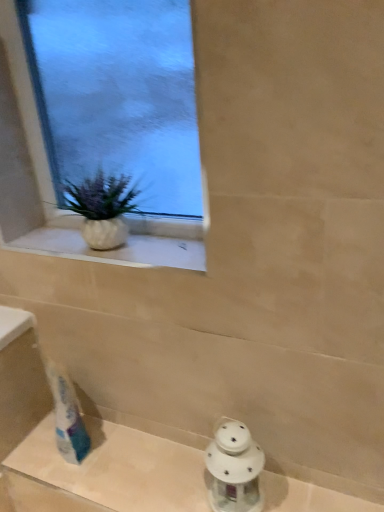
I want to click on white porcelain lantern at lower right, so click(234, 468).

From the image's perspective, is white porcelain lantern at lower right on top of clear glass window at upper left?

Incorrect, from the image's perspective, white porcelain lantern at lower right is lower than clear glass window at upper left.

Between white porcelain lantern at lower right and clear glass window at upper left, which one appears on the left side from the viewer's perspective?

Positioned to the left is clear glass window at upper left.

Is white porcelain lantern at lower right facing away from clear glass window at upper left?

No, white porcelain lantern at lower right is not facing the opposite direction of clear glass window at upper left.

In the scene shown: From a real-world perspective, is white porcelain lantern at lower right beneath clear glass window at upper left?

Yes, from a real-world perspective, white porcelain lantern at lower right is beneath clear glass window at upper left.

Looking at this image, which of these two, white glass lantern at lower center or clear glass window at upper left, is thinner?

With smaller width is clear glass window at upper left.

Is white glass lantern at lower center closer to camera compared to clear glass window at upper left?

Yes, it is.

From the image's perspective, relative to clear glass window at upper left, is white glass lantern at lower center above or below?

From the image's perspective, white glass lantern at lower center appears below clear glass window at upper left.

Considering the relative positions of white glass lantern at lower center and white porcelain lantern at lower right in the image provided, is white glass lantern at lower center to the left of white porcelain lantern at lower right from the viewer's perspective?

Correct, you'll find white glass lantern at lower center to the left of white porcelain lantern at lower right.

This screenshot has height=512, width=384. I want to click on porcelain that is behind the white glass lantern at lower center, so click(234, 468).

From the image's perspective, is white glass lantern at lower center located above white porcelain lantern at lower right?

No, from the image's perspective, white glass lantern at lower center is not above white porcelain lantern at lower right.

Can we say white glass lantern at lower center lies outside white porcelain lantern at lower right?

Yes, white glass lantern at lower center is not within white porcelain lantern at lower right.

Is white textured vase at upper left to the left of clear glass window at upper left from the viewer's perspective?

Indeed, white textured vase at upper left is positioned on the left side of clear glass window at upper left.

Considering the relative sizes of white textured vase at upper left and clear glass window at upper left in the image provided, is white textured vase at upper left thinner than clear glass window at upper left?

Incorrect, the width of white textured vase at upper left is not less than that of clear glass window at upper left.

From the image's perspective, is white textured vase at upper left positioned above or below clear glass window at upper left?

white textured vase at upper left is below clear glass window at upper left.

Where is `window above the white textured vase at upper left (from the image's perspective)`? The image size is (384, 512). window above the white textured vase at upper left (from the image's perspective) is located at coordinates (101, 125).

Is clear glass window at upper left with white porcelain lantern at lower right?

There is a gap between clear glass window at upper left and white porcelain lantern at lower right.

From the image's perspective, is clear glass window at upper left located above or below white porcelain lantern at lower right?

Based on their image positions, clear glass window at upper left is located above white porcelain lantern at lower right.

Which point is more forward, (104, 61) or (236, 441)?

The point (236, 441) is closer to the camera.

From the image's perspective, between white textured vase at upper left and white glass lantern at lower center, who is located below?

white glass lantern at lower center appears lower in the image.

Is white textured vase at upper left in front of white glass lantern at lower center?

No, white textured vase at upper left is further to the viewer.

Is white textured vase at upper left facing away from white glass lantern at lower center?

No, white textured vase at upper left is not facing away from white glass lantern at lower center.

This screenshot has height=512, width=384. I want to click on bath that is under the white textured vase at upper left (from a real-world perspective), so click(x=118, y=468).

Looking at this image, from a real-world perspective, is white glass lantern at lower center positioned above or below white textured vase at upper left?

Clearly, from a real-world perspective, white glass lantern at lower center is below white textured vase at upper left.

Looking at this image, based on their positions, is white glass lantern at lower center located to the left or right of white textured vase at upper left?

white glass lantern at lower center is positioned on white textured vase at upper left's right side.

Locate an element on the screen. porcelain on the right of the clear glass window at upper left is located at coordinates (234, 468).

Where is `bath below the clear glass window at upper left (from the image's perspective)`? bath below the clear glass window at upper left (from the image's perspective) is located at coordinates (118, 468).

Which object lies further to the anchor point white porcelain lantern at lower right, clear glass window at upper left or white textured vase at upper left?

The object further to white porcelain lantern at lower right is clear glass window at upper left.

Based on their spatial positions, is white glass lantern at lower center or white textured vase at upper left closer to clear glass window at upper left?

white textured vase at upper left is positioned closer to the anchor clear glass window at upper left.

Which object lies further to the anchor point white glass lantern at lower center, white porcelain lantern at lower right or white textured vase at upper left?

Among the two, white textured vase at upper left is located further to white glass lantern at lower center.

Which object lies further to the anchor point clear glass window at upper left, white porcelain lantern at lower right or white glass lantern at lower center?

white glass lantern at lower center lies further to clear glass window at upper left than the other object.

Consider the image. From the image, which object appears to be nearer to clear glass window at upper left, white glass lantern at lower center or white porcelain lantern at lower right?

white porcelain lantern at lower right.

From the image, which object appears to be farther from white glass lantern at lower center, white textured vase at upper left or white porcelain lantern at lower right?

Based on the image, white textured vase at upper left appears to be further to white glass lantern at lower center.

Based on the photo, from the image, which object appears to be nearer to white textured vase at upper left, white porcelain lantern at lower right or white glass lantern at lower center?

white porcelain lantern at lower right is positioned closer to the anchor white textured vase at upper left.

When comparing their distances from white glass lantern at lower center, does white textured vase at upper left or clear glass window at upper left seem closer?

white textured vase at upper left.

Find the location of a particular element. porcelain between white textured vase at upper left and white glass lantern at lower center from top to bottom is located at coordinates click(x=234, y=468).

Where is `porcelain between clear glass window at upper left and white glass lantern at lower center in the up-down direction`? Image resolution: width=384 pixels, height=512 pixels. porcelain between clear glass window at upper left and white glass lantern at lower center in the up-down direction is located at coordinates (234, 468).

Image resolution: width=384 pixels, height=512 pixels. What are the coordinates of `houseplant between clear glass window at upper left and white porcelain lantern at lower right from top to bottom` in the screenshot? It's located at (102, 208).

Locate an element on the screen. This screenshot has height=512, width=384. houseplant that lies between clear glass window at upper left and white glass lantern at lower center from top to bottom is located at coordinates (102, 208).